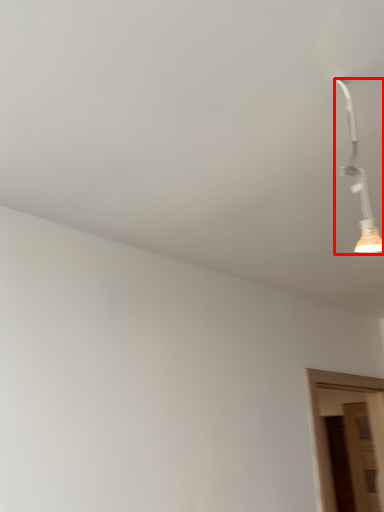
Question: In this image, where is lamp (annotated by the red box) located relative to door?

Choices:
 (A) right
 (B) left

Answer: (B)